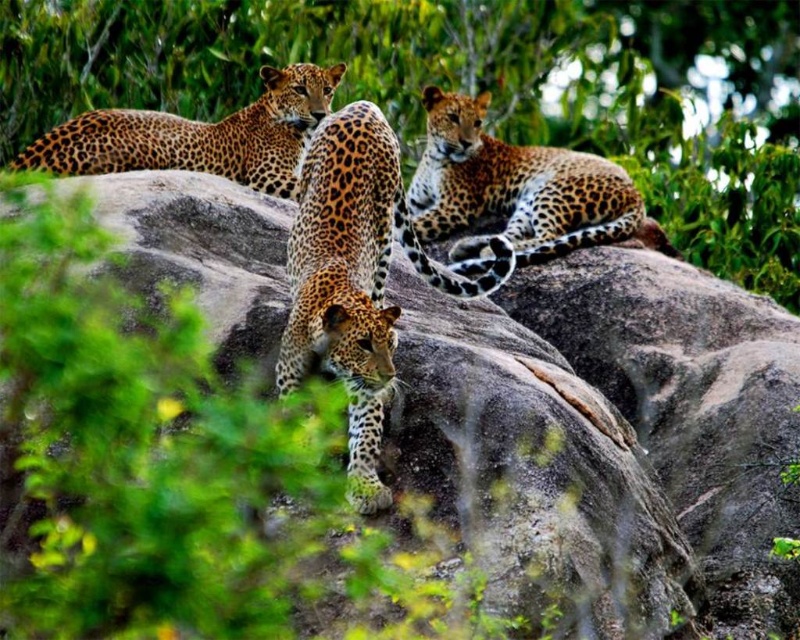
Question: Is gray rock at center positioned behind spotted fur cheetah at center?

Choices:
 (A) yes
 (B) no

Answer: (A)

Question: Which point is farther from the camera taking this photo?

Choices:
 (A) coord(352,256)
 (B) coord(734,328)

Answer: (B)

Question: Which object appears closest to the camera in this image?

Choices:
 (A) spotted fur cheetah at center
 (B) spotted fur cheetah at upper right

Answer: (A)

Question: Does spotted fur cheetah at upper right appear under spotted fur leopard at upper left?

Choices:
 (A) no
 (B) yes

Answer: (A)

Question: Is spotted fur cheetah at center to the left of spotted fur leopard at upper left from the viewer's perspective?

Choices:
 (A) no
 (B) yes

Answer: (A)

Question: Which object is closer to the camera taking this photo?

Choices:
 (A) spotted fur cheetah at center
 (B) spotted fur leopard at upper left

Answer: (A)